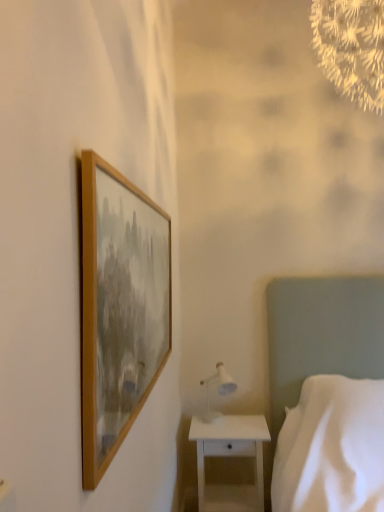
Where is `white glossy nightstand at lower right`? white glossy nightstand at lower right is located at coordinates 230,456.

Measure the distance between white glossy table lamp at lower right and camera.

They are 8.41 feet apart.

What do you see at coordinates (216, 391) in the screenshot? The width and height of the screenshot is (384, 512). I see `white glossy table lamp at lower right` at bounding box center [216, 391].

Where is `white glossy nightstand at lower right`? white glossy nightstand at lower right is located at coordinates (230, 456).

From a real-world perspective, is wooden frame at upper left physically above white glossy table lamp at lower right?

Indeed, from a real-world perspective, wooden frame at upper left stands above white glossy table lamp at lower right.

Are wooden frame at upper left and white glossy table lamp at lower right located far from each other?

wooden frame at upper left is positioned a significant distance from white glossy table lamp at lower right.

From the image's perspective, which is above, wooden frame at upper left or white glossy table lamp at lower right?

wooden frame at upper left, from the image's perspective.

At what (x,y) coordinates should I click in order to perform the action: click on bed that is below the wooden frame at upper left (from the image's perspective). Please return your answer as a coordinate pair (x, y). Image resolution: width=384 pixels, height=512 pixels. Looking at the image, I should click on (321, 333).

From a real-world perspective, is wooden frame at upper left on top of white fabric bed at right?

Correct, in the physical world, wooden frame at upper left is higher than white fabric bed at right.

Based on the photo, between wooden frame at upper left and white fabric bed at right, which one has more height?

white fabric bed at right is taller.

Is wooden frame at upper left located outside white fabric bed at right?

Yes, wooden frame at upper left is not within white fabric bed at right.

Locate an element on the screen. nightstand on the right of white glossy table lamp at lower right is located at coordinates (230, 456).

Measure the distance between white glossy table lamp at lower right and white glossy nightstand at lower right.

A distance of 11.91 inches exists between white glossy table lamp at lower right and white glossy nightstand at lower right.

Do you think white glossy table lamp at lower right is within white glossy nightstand at lower right, or outside of it?

white glossy table lamp at lower right cannot be found inside white glossy nightstand at lower right.

Considering the sizes of objects white glossy table lamp at lower right and white glossy nightstand at lower right in the image provided, who is taller, white glossy table lamp at lower right or white glossy nightstand at lower right?

Standing taller between the two is white glossy nightstand at lower right.

From the image's perspective, which is above, wooden frame at upper left or white glossy nightstand at lower right?

From the image's view, wooden frame at upper left is above.

From a real-world perspective, is wooden frame at upper left positioned above or below white glossy nightstand at lower right?

wooden frame at upper left is situated higher than white glossy nightstand at lower right in the real world.

Between wooden frame at upper left and white glossy nightstand at lower right, which one has more height?

wooden frame at upper left is taller.

You are a GUI agent. You are given a task and a screenshot of the screen. Output one action in this format:
    pyautogui.click(x=<x>, y=<y>)
    Task: Click on the picture frame to the left of white glossy nightstand at lower right
    
    Given the screenshot: What is the action you would take?
    pyautogui.click(x=119, y=308)

Is white fabric bed at right oriented away from white glossy table lamp at lower right?

white fabric bed at right is not turned away from white glossy table lamp at lower right.

From the picture: From a real-world perspective, between white fabric bed at right and white glossy table lamp at lower right, who is vertically lower?

In real-world perspective, white fabric bed at right is lower.

Does white fabric bed at right have a greater height compared to white glossy table lamp at lower right?

Correct, white fabric bed at right is much taller as white glossy table lamp at lower right.

Looking at this image, can you tell me how much white fabric bed at right and white glossy table lamp at lower right differ in facing direction?

The angle between the facing direction of white fabric bed at right and the facing direction of white glossy table lamp at lower right is 1.49 degrees.

From a real-world perspective, which is physically above, white fabric bed at right or white glossy nightstand at lower right?

white fabric bed at right, from a real-world perspective.

Is white fabric bed at right positioned far away from white glossy nightstand at lower right?

No, white fabric bed at right is not far away from white glossy nightstand at lower right.

From the image's perspective, is white fabric bed at right positioned above or below white glossy nightstand at lower right?

white fabric bed at right is above white glossy nightstand at lower right.

Is white fabric bed at right to the left of white glossy nightstand at lower right from the viewer's perspective?

No.

Could you tell me if white glossy nightstand at lower right is turned towards wooden frame at upper left?

No, white glossy nightstand at lower right is not turned towards wooden frame at upper left.

Is point (215, 423) behind point (162, 358)?

Yes.

Can you tell me how much white glossy nightstand at lower right and wooden frame at upper left differ in facing direction?

The angle between the facing direction of white glossy nightstand at lower right and the facing direction of wooden frame at upper left is 89.4 degrees.

Image resolution: width=384 pixels, height=512 pixels. Identify the location of nightstand on the right side of wooden frame at upper left. (230, 456).

The image size is (384, 512). What are the coordinates of `table lamp that appears below the wooden frame at upper left (from a real-world perspective)` in the screenshot? It's located at (216, 391).

Where is `bed in front of the wooden frame at upper left`? bed in front of the wooden frame at upper left is located at coordinates (321, 333).

Considering their positions, is white glossy table lamp at lower right positioned closer to white glossy nightstand at lower right than wooden frame at upper left?

white glossy table lamp at lower right.

When comparing their distances from wooden frame at upper left, does white fabric bed at right or white glossy nightstand at lower right seem further?

white fabric bed at right lies further to wooden frame at upper left than the other object.

From the image, which object appears to be nearer to white fabric bed at right, white glossy table lamp at lower right or wooden frame at upper left?

white glossy table lamp at lower right lies closer to white fabric bed at right than the other object.

Considering their positions, is wooden frame at upper left positioned further to white fabric bed at right than white glossy table lamp at lower right?

wooden frame at upper left.

Based on their spatial positions, is white glossy nightstand at lower right or wooden frame at upper left closer to white fabric bed at right?

white glossy nightstand at lower right is positioned closer to the anchor white fabric bed at right.

Based on their spatial positions, is white glossy table lamp at lower right or white fabric bed at right further from wooden frame at upper left?

white fabric bed at right is further to wooden frame at upper left.

Which object lies nearer to the anchor point white glossy table lamp at lower right, white fabric bed at right or wooden frame at upper left?

white fabric bed at right is closer to white glossy table lamp at lower right.

Which object lies nearer to the anchor point white fabric bed at right, white glossy table lamp at lower right or white glossy nightstand at lower right?

white glossy nightstand at lower right lies closer to white fabric bed at right than the other object.

Where is `picture frame between white fabric bed at right and white glossy table lamp at lower right in the front-back direction`? The width and height of the screenshot is (384, 512). picture frame between white fabric bed at right and white glossy table lamp at lower right in the front-back direction is located at coordinates (119, 308).

Identify the location of nightstand between white fabric bed at right and white glossy table lamp at lower right in the front-back direction. (230, 456).

Where is `nightstand between wooden frame at upper left and white glossy table lamp at lower right in the front-back direction`? This screenshot has width=384, height=512. nightstand between wooden frame at upper left and white glossy table lamp at lower right in the front-back direction is located at coordinates (230, 456).

Locate an element on the screen. The width and height of the screenshot is (384, 512). picture frame positioned between white fabric bed at right and white glossy nightstand at lower right from near to far is located at coordinates (119, 308).